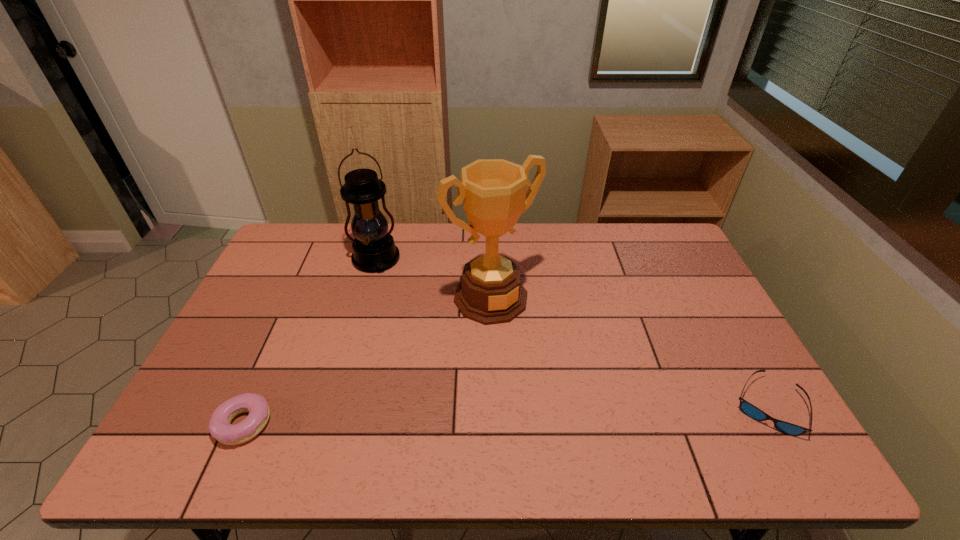
Where is `vacant space at the near edge of the desktop`? Image resolution: width=960 pixels, height=540 pixels. vacant space at the near edge of the desktop is located at coordinates pos(304,417).

I want to click on vacant region at the left edge of the desktop, so (x=279, y=328).

This screenshot has width=960, height=540. I want to click on vacant space at the right edge of the desktop, so click(732, 351).

Where is `vacant space at the far left corner of the desktop`? The height and width of the screenshot is (540, 960). vacant space at the far left corner of the desktop is located at coordinates (290, 255).

This screenshot has width=960, height=540. In order to click on vacant region at the far right corner of the desktop in this screenshot , I will do pos(682,248).

You are a GUI agent. You are given a task and a screenshot of the screen. Output one action in this format:
    pyautogui.click(x=<x>, y=<y>)
    Task: Click on the free point at the near right corner
    
    Given the screenshot: What is the action you would take?
    pyautogui.click(x=730, y=408)

At what (x,y) coordinates should I click in order to perform the action: click on vacant area that lies between the third shortest object and the second object from right to left. Please return your answer as a coordinate pair (x, y). Looking at the image, I should click on (433, 279).

The width and height of the screenshot is (960, 540). Identify the location of blank region between the award and the rightmost object. (629, 353).

Find the location of a particular element. vacant space that is in between the lantern and the rightmost object is located at coordinates (572, 333).

Find the location of a particular element. vacant region between the rightmost object and the doughnut is located at coordinates (506, 415).